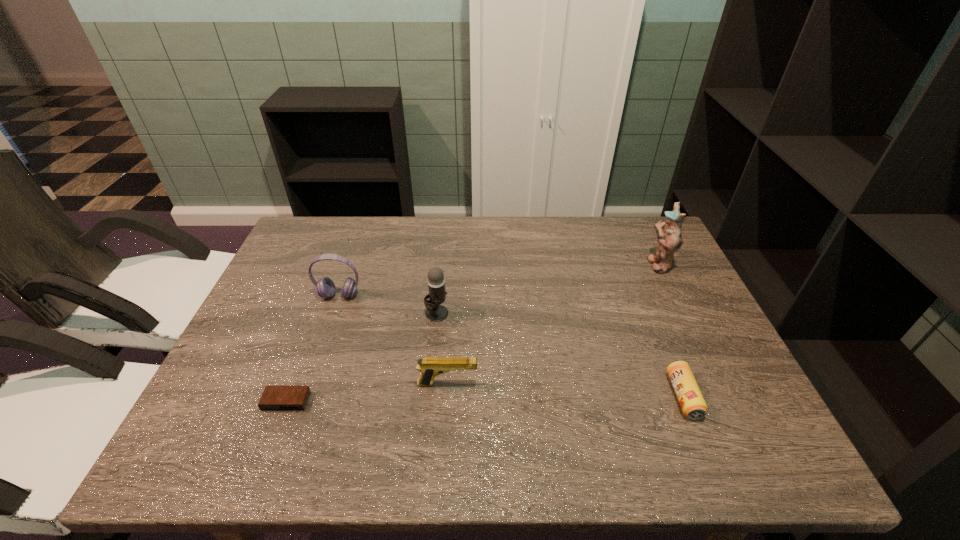
Locate an element on the screen. beer can that is at the right edge is located at coordinates (693, 405).

Locate an element on the screen. object that is at the far right corner is located at coordinates (668, 232).

Where is `blank space at the far edge`? Image resolution: width=960 pixels, height=540 pixels. blank space at the far edge is located at coordinates (470, 258).

What are the coordinates of `vacant space at the left edge of the desktop` in the screenshot? It's located at (290, 349).

Locate an element on the screen. This screenshot has width=960, height=540. free space at the right edge of the desktop is located at coordinates (678, 272).

Image resolution: width=960 pixels, height=540 pixels. In the image, there is a desktop. What are the coordinates of `vacant space at the far right corner` in the screenshot? It's located at (612, 230).

This screenshot has width=960, height=540. I want to click on vacant region between the beer can and the rightmost object, so click(670, 330).

Identify the location of vacant space in between the headset and the microphone. This screenshot has width=960, height=540. (388, 304).

The width and height of the screenshot is (960, 540). What are the coordinates of `free space between the beer can and the headset` in the screenshot? It's located at pyautogui.click(x=512, y=346).

Identify the location of free area in between the fourth tallest object and the headset. (394, 340).